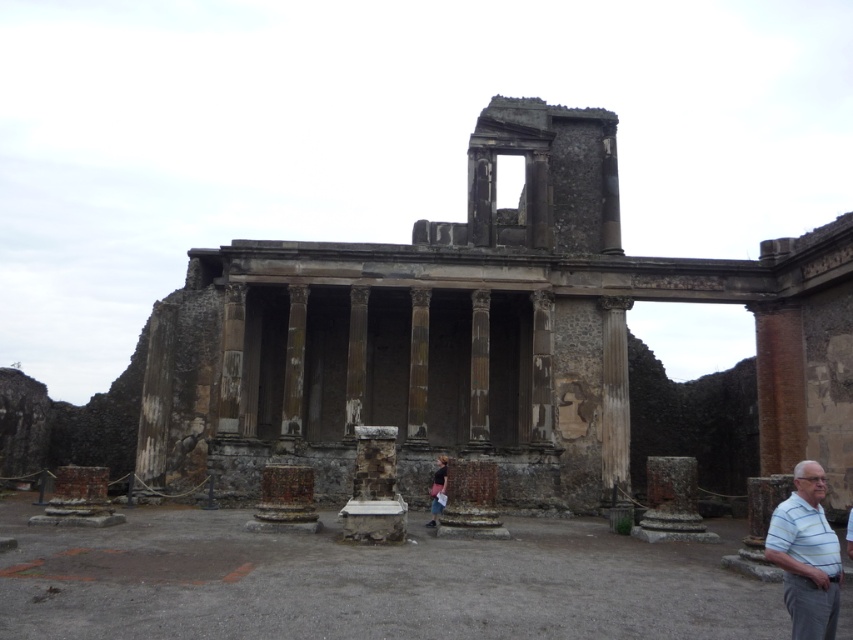
Question: Is white striped shirt at lower right closer to camera compared to denim jacket at center?

Choices:
 (A) no
 (B) yes

Answer: (B)

Question: Estimate the real-world distances between objects in this image. Which object is closer to the rusty stone columns at center?

Choices:
 (A) white striped shirt at lower right
 (B) denim jacket at center
 (C) weathered stone column at center

Answer: (C)

Question: Which point is farther to the camera?

Choices:
 (A) weathered stone column at center
 (B) denim jacket at center
 (C) white striped shirt at lower right

Answer: (A)

Question: Is rusty stone columns at center further to camera compared to white striped shirt at lower right?

Choices:
 (A) no
 (B) yes

Answer: (B)

Question: Does rusty stone columns at center have a smaller size compared to white striped shirt at lower right?

Choices:
 (A) no
 (B) yes

Answer: (A)

Question: Which object is positioned closest to the white striped shirt at lower right?

Choices:
 (A) rusty stone columns at center
 (B) denim jacket at center

Answer: (B)